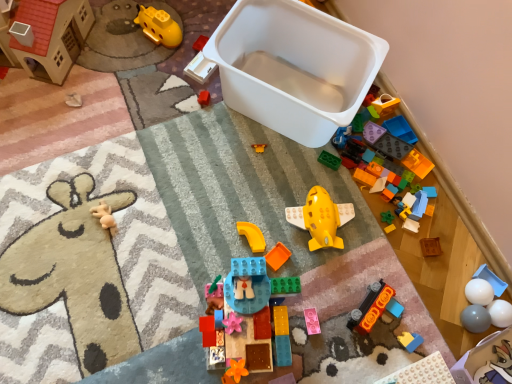
I want to click on vacant space that's between orange matte car at lower right, the 8th toy in the right-to-left sequence, and yellow matte airplane at center, the 8th toy from the left, so click(343, 272).